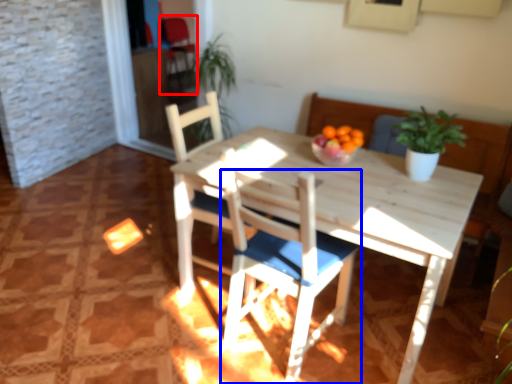
Question: Which object is further to the camera taking this photo, armchair (highlighted by a red box) or chair (highlighted by a blue box)?

Choices:
 (A) armchair
 (B) chair

Answer: (A)